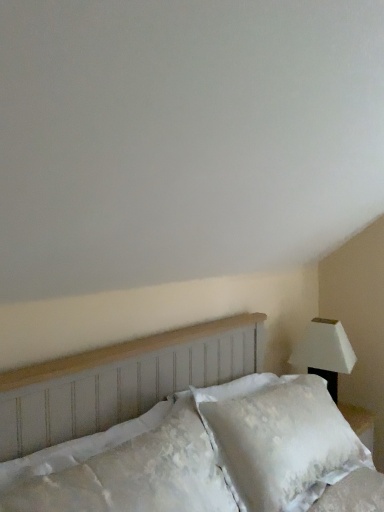
Where is `white textured pillow at lower left`? white textured pillow at lower left is located at coordinates (132, 473).

This screenshot has width=384, height=512. What do you see at coordinates (132, 473) in the screenshot?
I see `white textured pillow at lower left` at bounding box center [132, 473].

What is the approximate height of white textured headboard at center?

69.71 centimeters.

You are a GUI agent. You are given a task and a screenshot of the screen. Output one action in this format:
    pyautogui.click(x=<x>, y=<y>)
    Task: Click on the white matte lamp at right
    This screenshot has height=512, width=384.
    Given the screenshot: What is the action you would take?
    pyautogui.click(x=325, y=352)

Locate an element on the screen. white textured pillow at lower left is located at coordinates (132, 473).

Which object is positioned more to the right, white textured headboard at center or white matte lamp at right?

Positioned to the right is white matte lamp at right.

From a real-world perspective, is white textured headboard at center beneath white matte lamp at right?

No, from a real-world perspective, white textured headboard at center is not below white matte lamp at right.

How different are the orientations of white textured headboard at center and white matte lamp at right in degrees?

The facing directions of white textured headboard at center and white matte lamp at right are 0.000577 degrees apart.

Is white textured headboard at center positioned beyond the bounds of white matte lamp at right?

Indeed, white textured headboard at center is completely outside white matte lamp at right.

Based on their sizes in the image, would you say white textured headboard at center is bigger or smaller than white textured pillow at lower left?

In the image, white textured headboard at center appears to be larger than white textured pillow at lower left.

Is white textured headboard at center surrounding white textured pillow at lower left?

Yes, white textured pillow at lower left can be found within white textured headboard at center.

Measure the distance from white textured headboard at center to white textured pillow at lower left.

white textured headboard at center and white textured pillow at lower left are 5.26 inches apart.

From a real-world perspective, is white textured pillow at lower left below white matte lamp at right?

No, from a real-world perspective, white textured pillow at lower left is not beneath white matte lamp at right.

Does white textured pillow at lower left appear on the right side of white matte lamp at right?

In fact, white textured pillow at lower left is to the left of white matte lamp at right.

Considering the sizes of objects white textured pillow at lower left and white matte lamp at right in the image provided, who is bigger, white textured pillow at lower left or white matte lamp at right?

white matte lamp at right is bigger.

From a real-world perspective, relative to white textured headboard at center, is white textured pillow at lower left vertically above or below?

In terms of real-world spatial position, white textured pillow at lower left is above white textured headboard at center.

Between point (110, 506) and point (278, 483), which one is positioned behind?

Positioned behind is point (278, 483).

From the picture: Who is more distant, white textured pillow at lower left or white textured headboard at center?

white textured pillow at lower left is further from the camera.

Looking at this image, does white matte lamp at right lie in front of white textured pillow at lower left?

No.

Is white matte lamp at right inside the boundaries of white textured pillow at lower left, or outside?

white matte lamp at right cannot be found inside white textured pillow at lower left.

From a real-world perspective, who is located lower, white matte lamp at right or white textured pillow at lower left?

white matte lamp at right.

Is white matte lamp at right wider than white textured pillow at lower left?

Yes.

Considering the sizes of white matte lamp at right and white textured headboard at center in the image, is white matte lamp at right taller or shorter than white textured headboard at center?

In the image, white matte lamp at right appears to be shorter than white textured headboard at center.

Considering the positions of points (315, 368) and (211, 403), is point (315, 368) farther from camera compared to point (211, 403)?

Yes, point (315, 368) is farther from viewer.

Can you tell me how much white matte lamp at right and white textured headboard at center differ in facing direction?

There is a 0.000577-degree angle between the facing directions of white matte lamp at right and white textured headboard at center.

From the picture: Which object is wider, white matte lamp at right or white textured headboard at center?

white textured headboard at center is wider.

Find the location of a particular element. This screenshot has width=384, height=512. lamp that is behind the white textured headboard at center is located at coordinates (325, 352).

Locate an element on the screen. The image size is (384, 512). pillow located above the white textured headboard at center (from a real-world perspective) is located at coordinates (132, 473).

In the scene shown: When comparing their distances from white matte lamp at right, does white textured pillow at lower left or white textured headboard at center seem further?

The object further to white matte lamp at right is white textured pillow at lower left.

Which object lies further to the anchor point white textured pillow at lower left, white matte lamp at right or white textured headboard at center?

white matte lamp at right is positioned further to the anchor white textured pillow at lower left.

Looking at the image, which one is located closer to white textured headboard at center, white matte lamp at right or white textured pillow at lower left?

Among the two, white textured pillow at lower left is located nearer to white textured headboard at center.

Looking at the image, which one is located closer to white textured pillow at lower left, white textured headboard at center or white matte lamp at right?

white textured headboard at center is closer to white textured pillow at lower left.

Which object lies further to the anchor point white matte lamp at right, white textured headboard at center or white textured pillow at lower left?

white textured pillow at lower left is positioned further to the anchor white matte lamp at right.

Considering their positions, is white textured pillow at lower left positioned further to white textured headboard at center than white matte lamp at right?

Based on the image, white matte lamp at right appears to be further to white textured headboard at center.

The image size is (384, 512). Find the location of `pillow between white textured headboard at center and white matte lamp at right in the front-back direction`. pillow between white textured headboard at center and white matte lamp at right in the front-back direction is located at coordinates (132, 473).